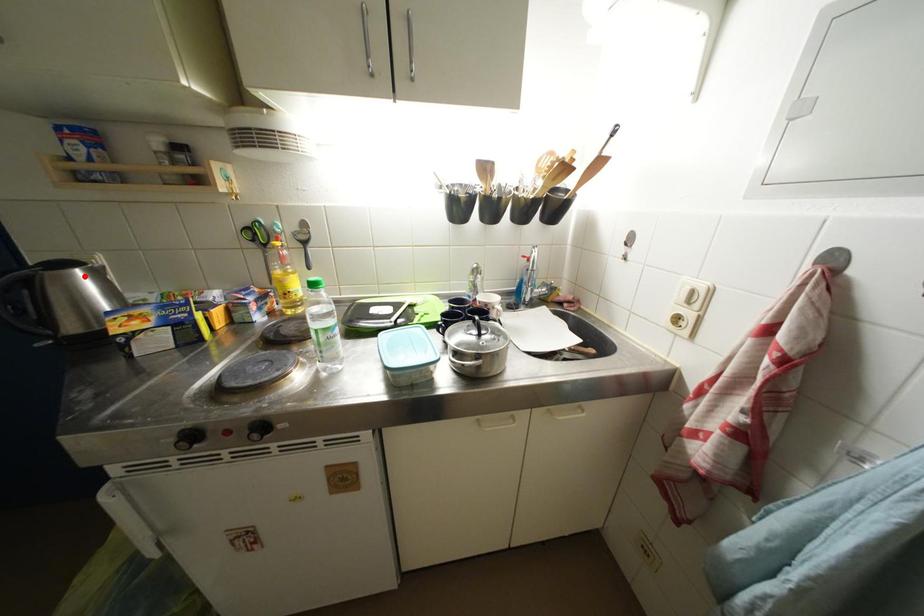
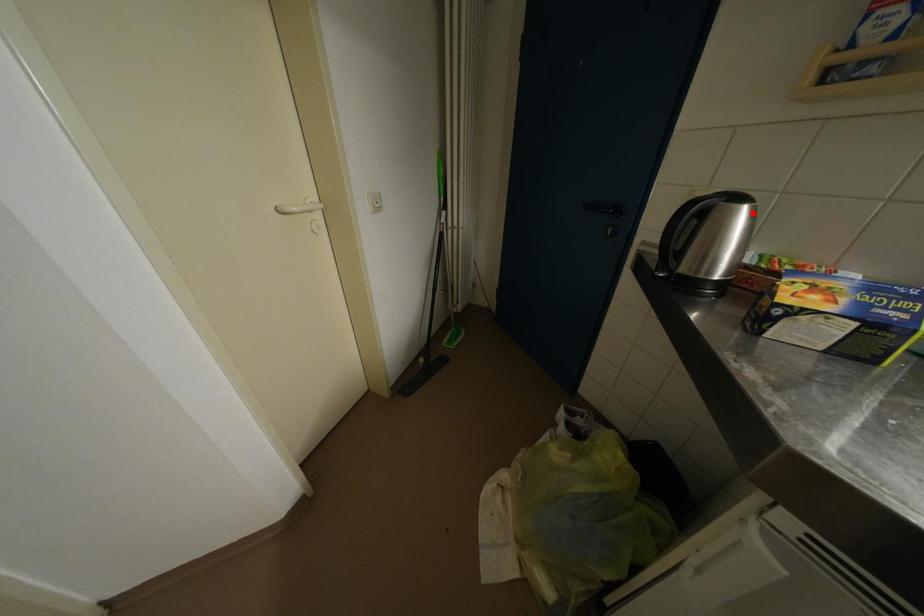
I am providing you with two images of the same scene from different viewpoints. A red point is marked on the first image and another point is marked on the second image. Does the point marked in image1 correspond to the same location as the one in image2?

Yes